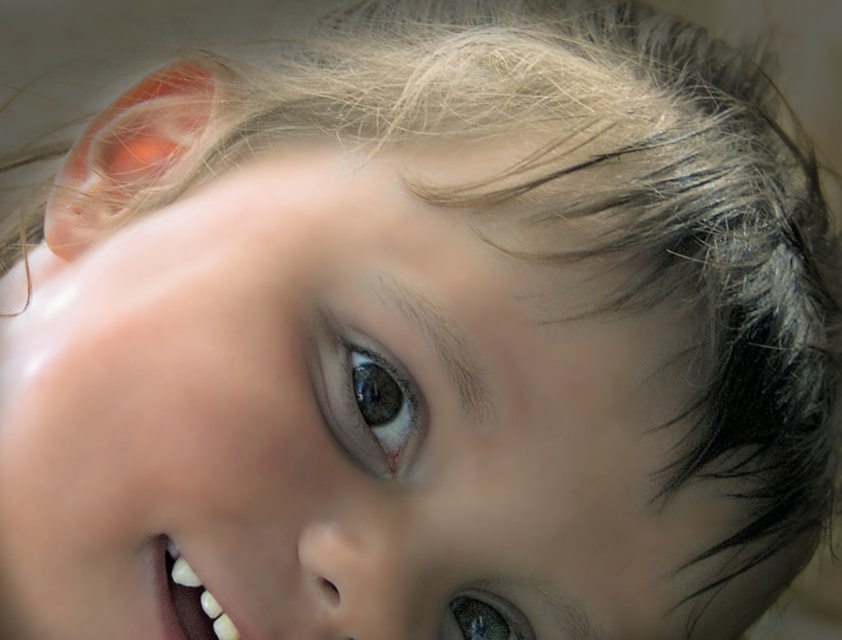
Which of these two, brown glossy eye at center or shiny brown eye at lower center, stands shorter?

With less height is shiny brown eye at lower center.

Is brown glossy eye at center above shiny brown eye at lower center?

Yes.

Find the location of `brown glossy eye at center`. brown glossy eye at center is located at coordinates coord(365,396).

Which is above, brown glossy eye at center or white glossy teeth at lower left?

brown glossy eye at center

Is brown glossy eye at center taller than white glossy teeth at lower left?

Correct, brown glossy eye at center is much taller as white glossy teeth at lower left.

I want to click on brown glossy eye at center, so click(365, 396).

Find the location of a particular element. Image resolution: width=842 pixels, height=640 pixels. brown glossy eye at center is located at coordinates (365, 396).

Between shiny brown eye at lower center and white glossy teeth at lower left, which one is positioned lower?

shiny brown eye at lower center is lower down.

Can you confirm if shiny brown eye at lower center is positioned above white glossy teeth at lower left?

Actually, shiny brown eye at lower center is below white glossy teeth at lower left.

Does point (512, 618) come in front of point (208, 595)?

That is False.

The image size is (842, 640). Find the location of `shiny brown eye at lower center`. shiny brown eye at lower center is located at coordinates (488, 616).